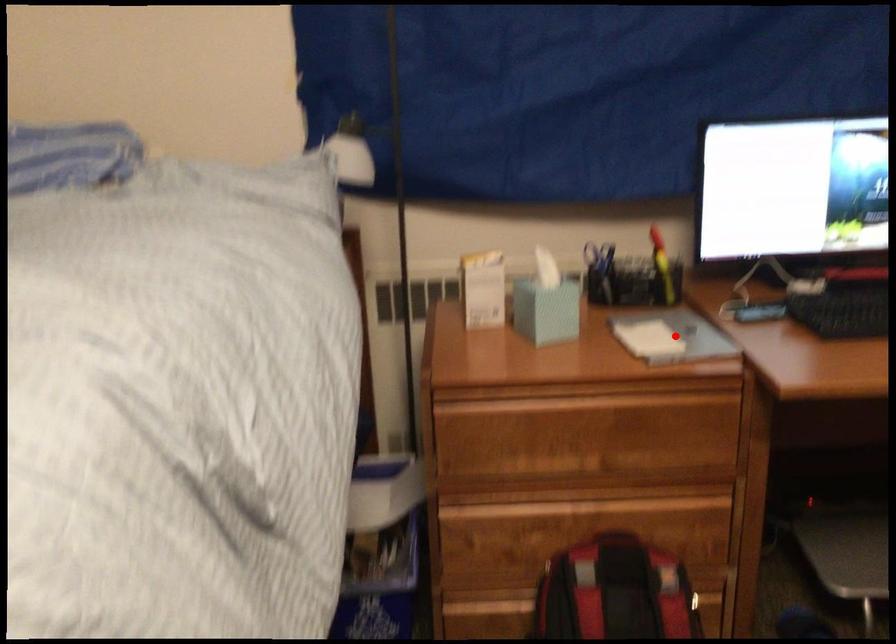
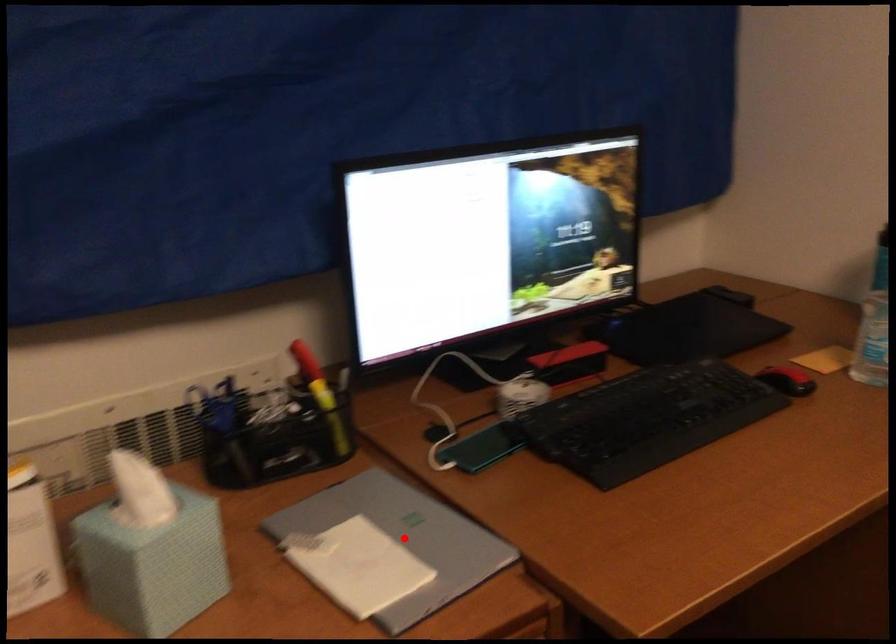
I am providing you with two images of the same scene from different viewpoints. A red point is marked on the first image and another point is marked on the second image. Is the marked point in image1 the same physical position as the marked point in image2?

Yes